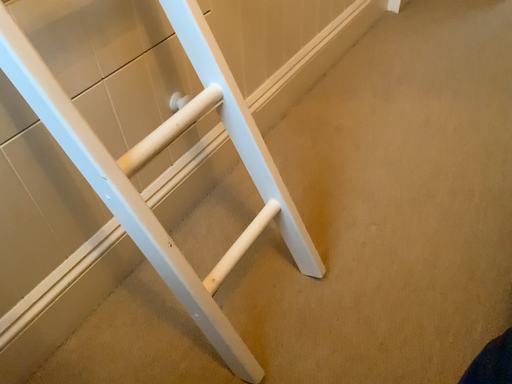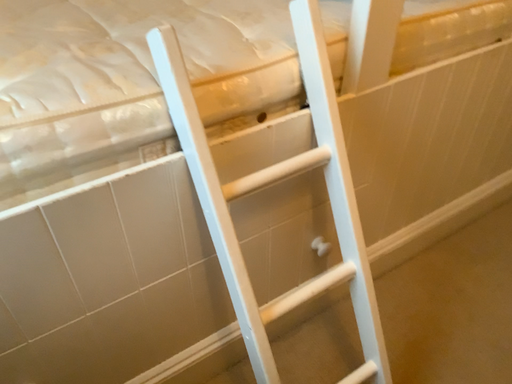
Question: Which way did the camera rotate in the video?

Choices:
 (A) rotated downward
 (B) rotated upward

Answer: (B)